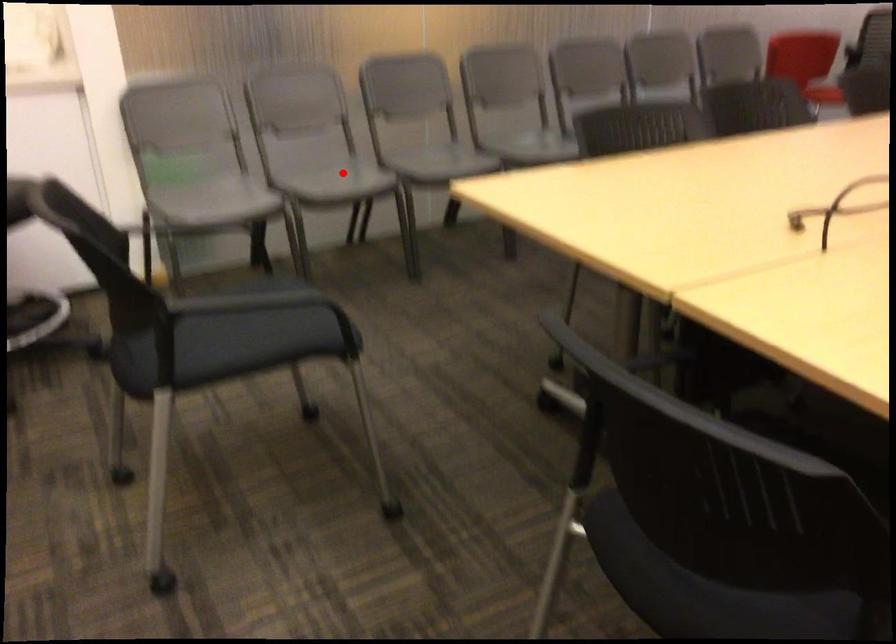
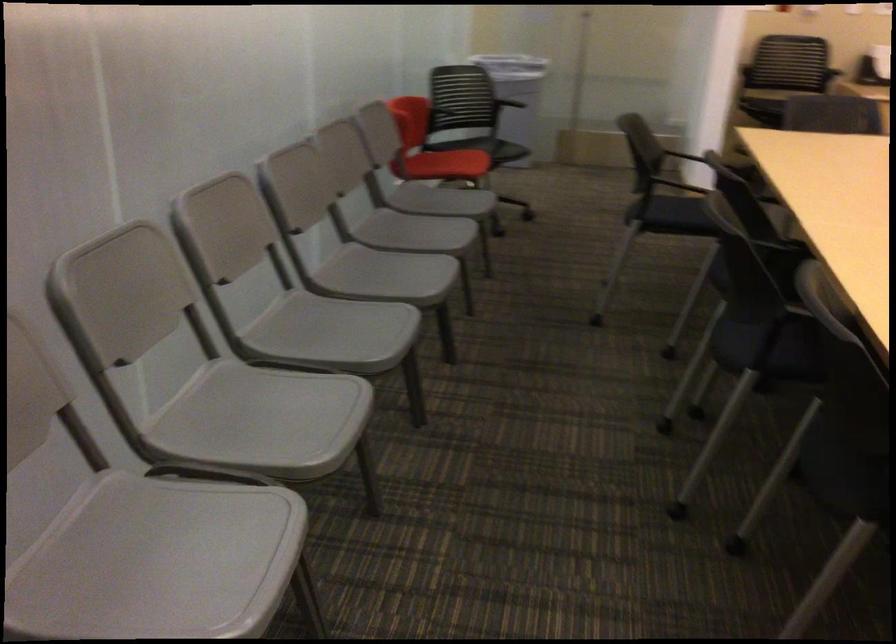
Question: I am providing you with two images of the same scene from different viewpoints. Image1 has a red point marked. In image2, the corresponding 3D location appears at what relative position? Reply with the corresponding letter.

Choices:
 (A) Closer
 (B) Farther

Answer: (A)